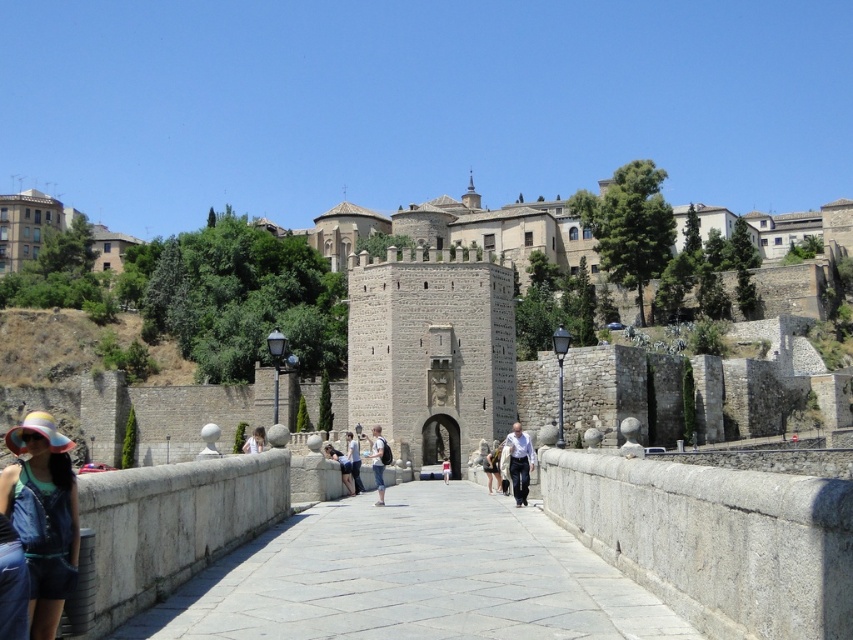
Question: Does light blue denim jeans at center have a greater width compared to white cotton shirt at center?

Choices:
 (A) no
 (B) yes

Answer: (B)

Question: Which of the following is the closest to the observer?

Choices:
 (A) denim shorts at center
 (B) light blue denim jacket at center
 (C) multicolored fabric hat at lower left
 (D) denim jeans at center

Answer: (C)

Question: Which point is farther from the camera taking this photo?

Choices:
 (A) (62, 488)
 (B) (512, 445)

Answer: (B)

Question: Can you confirm if light blue denim jeans at center is thinner than white cotton shirt at center?

Choices:
 (A) yes
 (B) no

Answer: (B)

Question: Does denim jeans at center come in front of denim shorts at center?

Choices:
 (A) yes
 (B) no

Answer: (A)

Question: Estimate the real-world distances between objects in this image. Which object is closer to the denim jeans at center?

Choices:
 (A) white cotton shirt at center
 (B) light blue denim jeans at center
 (C) gray stone path at center

Answer: (B)